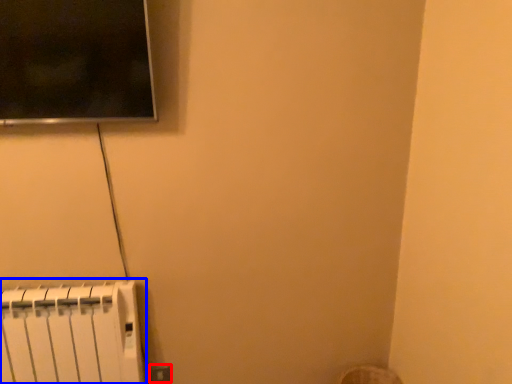
Question: Which point is closer to the camera, electric outlet (highlighted by a red box) or radiator (highlighted by a blue box)?

Choices:
 (A) electric outlet
 (B) radiator

Answer: (B)